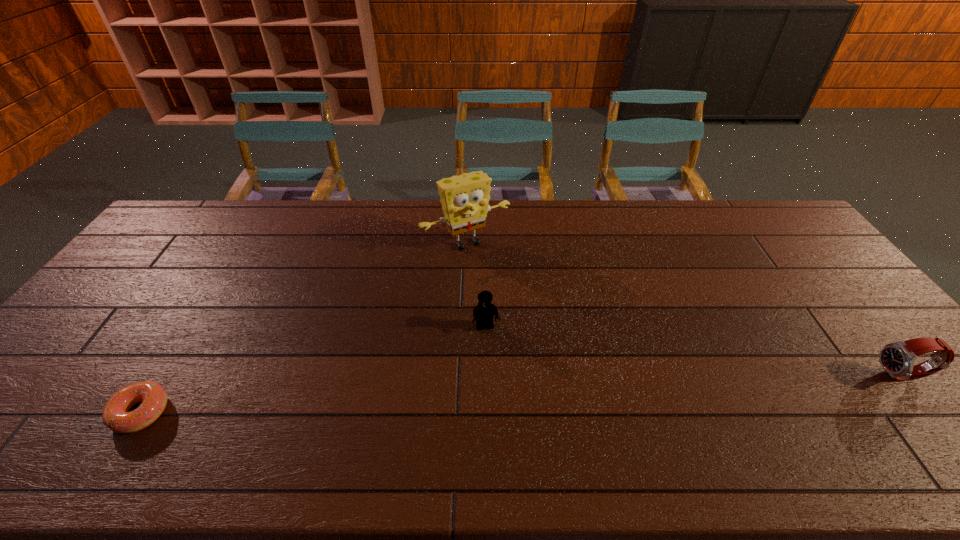
Identify the location of vacant space on the desktop that is between the doughnut and the rightmost object and is positioned on the face of the farthest object. Image resolution: width=960 pixels, height=540 pixels. (573, 392).

You are a GUI agent. You are given a task and a screenshot of the screen. Output one action in this format:
    pyautogui.click(x=<x>, y=<y>)
    Task: Click on the free space on the desktop that is between the shortest object and the rightmost object and is positioned on the front-facing side of the Lego
    Image resolution: width=960 pixels, height=540 pixels.
    Given the screenshot: What is the action you would take?
    point(501,395)